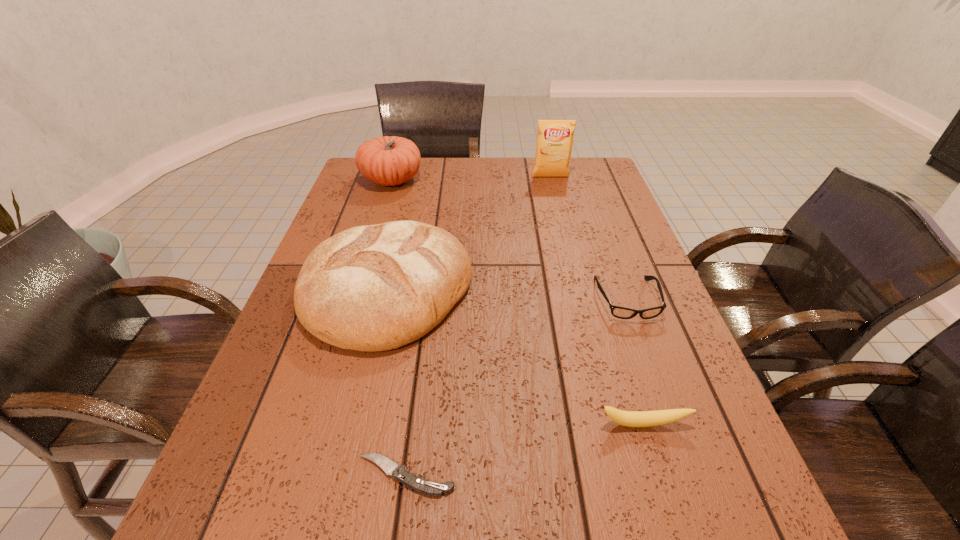
Locate an element on the screen. The image size is (960, 540). vacant area situated 0.080m on the back of the bread is located at coordinates (402, 224).

The image size is (960, 540). Find the location of `vacant space located on the upward curve of the fifth farthest object`. vacant space located on the upward curve of the fifth farthest object is located at coordinates (660, 481).

Locate an element on the screen. vacant space located 0.190m on the front-facing side of the spectacles is located at coordinates (661, 396).

Identify the location of vacant area situated 0.080m on the right of the shortest object. The height and width of the screenshot is (540, 960). (504, 475).

Image resolution: width=960 pixels, height=540 pixels. In order to click on crisp (potato chip) that is at the far edge in this screenshot , I will do `click(555, 137)`.

The image size is (960, 540). In order to click on pumpkin present at the far edge in this screenshot , I will do `click(390, 160)`.

Locate an element on the screen. The height and width of the screenshot is (540, 960). pumpkin positioned at the left edge is located at coordinates (390, 160).

Find the location of a particular element. This screenshot has height=540, width=960. bread at the left edge is located at coordinates (370, 288).

The height and width of the screenshot is (540, 960). In order to click on crisp (potato chip) present at the right edge in this screenshot , I will do `click(555, 137)`.

Identify the location of banana positioned at the right edge. (637, 419).